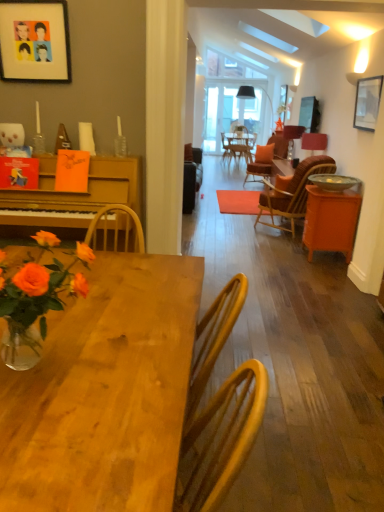
Measure the distance between wooden table at center and camera.

wooden table at center and camera are 31.15 inches apart.

What do you see at coordinates (367, 103) in the screenshot? This screenshot has height=512, width=384. I see `metallic silver picture frame at upper right` at bounding box center [367, 103].

Locate an element on the screen. translucent glass vase at lower left is located at coordinates (36, 303).

The height and width of the screenshot is (512, 384). What do you see at coordinates (292, 137) in the screenshot?
I see `matte black lampshade at upper center, the first lamp from the top` at bounding box center [292, 137].

Where is `matte black lampshade at upper center, which is counted as the second lamp, starting from the bottom`? matte black lampshade at upper center, which is counted as the second lamp, starting from the bottom is located at coordinates (292, 137).

Locate an element on the screen. metallic silver bowl at right is located at coordinates (333, 181).

Locate an element on the screen. Image resolution: width=384 pixels, height=512 pixels. wooden table at center is located at coordinates (104, 393).

What's the angular difference between matte red lampshade at right, which is the 2th lamp from back to front, and matte black lampshade at upper center, which is the second lamp in front-to-back order,'s facing directions?

They differ by 2.36 degrees in their facing directions.

Is matte red lampshade at right, which appears as the 1th lamp when ordered from the bottom, turned away from matte black lampshade at upper center, which is the second lamp in front-to-back order?

That's not correct — matte red lampshade at right, which appears as the 1th lamp when ordered from the bottom, is not looking away from matte black lampshade at upper center, which is the second lamp in front-to-back order.

Is matte red lampshade at right, which is the 2th lamp from back to front, not near matte black lampshade at upper center, arranged as the 1th lamp when viewed from the back?

No, matte red lampshade at right, which is the 2th lamp from back to front, is not far from matte black lampshade at upper center, arranged as the 1th lamp when viewed from the back.

From a real-world perspective, does matte red lampshade at right, which is the 2th lamp from back to front, stand above matte black lampshade at upper center, the first lamp from the top?

Indeed, from a real-world perspective, matte red lampshade at right, which is the 2th lamp from back to front, stands above matte black lampshade at upper center, the first lamp from the top.

In the scene shown: Is orange matte cabinet at right a part of metallic silver bowl at right?

No, orange matte cabinet at right is not surrounded by metallic silver bowl at right.

Is the surface of metallic silver bowl at right in direct contact with orange matte cabinet at right?

No, metallic silver bowl at right is not making contact with orange matte cabinet at right.

In the image, is metallic silver bowl at right positioned in front of or behind orange matte cabinet at right?

metallic silver bowl at right is positioned closer to the viewer than orange matte cabinet at right.

Could you tell me if metallic silver bowl at right is facing orange matte cabinet at right?

No, metallic silver bowl at right does not turn towards orange matte cabinet at right.

From a real-world perspective, is metallic silver bowl at right located higher than translucent glass vase at lower left?

No, from a real-world perspective, metallic silver bowl at right is not above translucent glass vase at lower left.

Is metallic silver bowl at right bigger or smaller than translucent glass vase at lower left?

Clearly, metallic silver bowl at right is smaller in size than translucent glass vase at lower left.

From the image's perspective, which one is positioned lower, metallic silver bowl at right or translucent glass vase at lower left?

translucent glass vase at lower left is shown below in the image.

Does point (348, 187) come closer to viewer compared to point (82, 256)?

No, (348, 187) is behind (82, 256).

Is metallic silver picture frame at upper right to the left or to the right of green leafy plant at upper left in the image?

In the image, metallic silver picture frame at upper right appears on the right side of green leafy plant at upper left.

Can you confirm if metallic silver picture frame at upper right is smaller than green leafy plant at upper left?

Incorrect, metallic silver picture frame at upper right is not smaller in size than green leafy plant at upper left.

Is point (364, 94) farther from viewer compared to point (30, 14)?

Yes, point (364, 94) is farther from viewer.

Is metallic silver picture frame at upper right facing towards green leafy plant at upper left?

Yes, metallic silver picture frame at upper right is turned towards green leafy plant at upper left.

How different are the orientations of green leafy plant at upper left and metallic silver picture frame at upper right in degrees?

89.3 degrees.

Would you say green leafy plant at upper left is a long distance from metallic silver picture frame at upper right?

green leafy plant at upper left is positioned a significant distance from metallic silver picture frame at upper right.

Is metallic silver picture frame at upper right at the back of green leafy plant at upper left?

No.

Looking at this image, from a real-world perspective, is wooden table at center beneath metallic silver picture frame at upper right?

Yes, from a real-world perspective, wooden table at center is below metallic silver picture frame at upper right.

Considering the points (112, 276) and (372, 123), which point is in front, point (112, 276) or point (372, 123)?

The point (112, 276) is closer.

Considering the relative sizes of wooden table at center and metallic silver picture frame at upper right in the image provided, is wooden table at center smaller than metallic silver picture frame at upper right?

Incorrect, wooden table at center is not smaller in size than metallic silver picture frame at upper right.

Is wooden table at center not near metallic silver picture frame at upper right?

Yes, wooden table at center is far from metallic silver picture frame at upper right.

Is point (58, 42) closer or farther from the camera than point (182, 393)?

Point (58, 42).

Considering the positions of objects green leafy plant at upper left and wooden table at center in the image provided, who is more to the left, green leafy plant at upper left or wooden table at center?

Positioned to the left is green leafy plant at upper left.

Do you think green leafy plant at upper left is within wooden table at center, or outside of it?

green leafy plant at upper left is not inside wooden table at center, it's outside.

Considering the sizes of green leafy plant at upper left and wooden table at center in the image, is green leafy plant at upper left taller or shorter than wooden table at center?

green leafy plant at upper left is shorter than wooden table at center.

At what (x,y) coordinates should I click in order to perform the action: click on lamp located on the right of matte red lampshade at right, the second lamp in the top-to-bottom sequence. Please return your answer as a coordinate pair (x, y). This screenshot has height=512, width=384. Looking at the image, I should click on (292, 137).

This screenshot has width=384, height=512. I want to click on table behind the metallic silver bowl at right, so click(x=330, y=221).

From the image, which object appears to be nearer to wooden table at center, wooden woven chair at right or orange matte cabinet at right?

orange matte cabinet at right.

Estimate the real-world distances between objects in this image. Which object is further from matte red lampshade at right, arranged as the first lamp when viewed from the front, green leafy plant at upper left or metallic silver picture frame at upper right?

Among the two, green leafy plant at upper left is located further to matte red lampshade at right, arranged as the first lamp when viewed from the front.

From the image, which object appears to be nearer to matte black lampshade at upper center, which is counted as the second lamp, starting from the bottom, translucent glass vase at lower left or orange matte cabinet at right?

orange matte cabinet at right is closer to matte black lampshade at upper center, which is counted as the second lamp, starting from the bottom.

Looking at the image, which one is located closer to translucent glass vase at lower left, orange matte cabinet at right or wooden woven chair at right?

Based on the image, orange matte cabinet at right appears to be nearer to translucent glass vase at lower left.

When comparing their distances from translucent glass vase at lower left, does matte black lampshade at upper center, arranged as the 1th lamp when viewed from the back, or metallic silver bowl at right seem closer?

Among the two, metallic silver bowl at right is located nearer to translucent glass vase at lower left.

Looking at the image, which one is located further to metallic silver picture frame at upper right, green leafy plant at upper left or orange matte cabinet at right?

green leafy plant at upper left lies further to metallic silver picture frame at upper right than the other object.

When comparing their distances from translucent glass vase at lower left, does metallic silver bowl at right or matte red lampshade at right, the second lamp in the top-to-bottom sequence, seem closer?

Based on the image, metallic silver bowl at right appears to be nearer to translucent glass vase at lower left.

Looking at this image, estimate the real-world distances between objects in this image. Which object is closer to translucent glass vase at lower left, matte black lampshade at upper center, arranged as the 1th lamp when viewed from the back, or wooden woven chair at right?

Among the two, wooden woven chair at right is located nearer to translucent glass vase at lower left.

Locate an element on the screen. bowl between translucent glass vase at lower left and matte red lampshade at right, arranged as the first lamp when viewed from the front, along the z-axis is located at coordinates (333, 181).

This screenshot has width=384, height=512. In order to click on picture frame positioned between translucent glass vase at lower left and metallic silver bowl at right from near to far in this screenshot , I will do `click(367, 103)`.

Locate an element on the screen. lamp positioned between green leafy plant at upper left and matte black lampshade at upper center, the first lamp from the top, from near to far is located at coordinates (314, 142).

Find the location of a particular element. table between translucent glass vase at lower left and matte red lampshade at right, which is the 2th lamp from back to front, in the front-back direction is located at coordinates (330, 221).